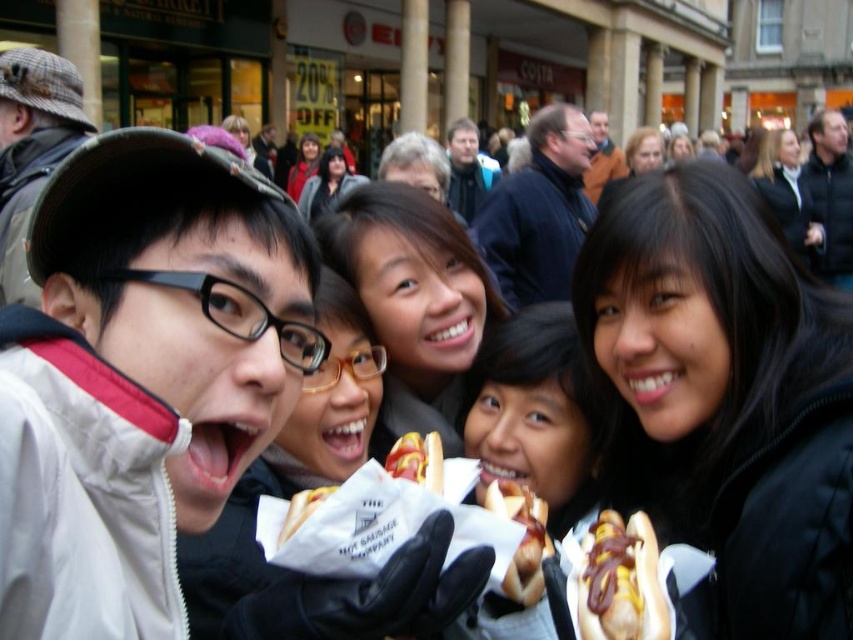
Question: Which point is closer to the camera?

Choices:
 (A) golden brown bun at center
 (B) shiny brown hot dog at center

Answer: (B)

Question: Among these points, which one is nearest to the camera?

Choices:
 (A) (409, 440)
 (B) (498, 502)
 (C) (585, 608)

Answer: (C)

Question: Which point is farther to the camera?

Choices:
 (A) golden brown bun at center
 (B) shiny brown hot dog at center
 (C) white paper hot dog at center

Answer: (A)

Question: Considering the relative positions of golden brown bun at center and white paper hot dog at center in the image provided, where is golden brown bun at center located with respect to white paper hot dog at center?

Choices:
 (A) left
 (B) right

Answer: (B)

Question: Can you confirm if smooth yellow hot dog at center is positioned above white paper hot dog at center?

Choices:
 (A) yes
 (B) no

Answer: (A)

Question: Is the position of shiny brown hot dog at center less distant than that of smooth yellow hot dog at center?

Choices:
 (A) yes
 (B) no

Answer: (A)